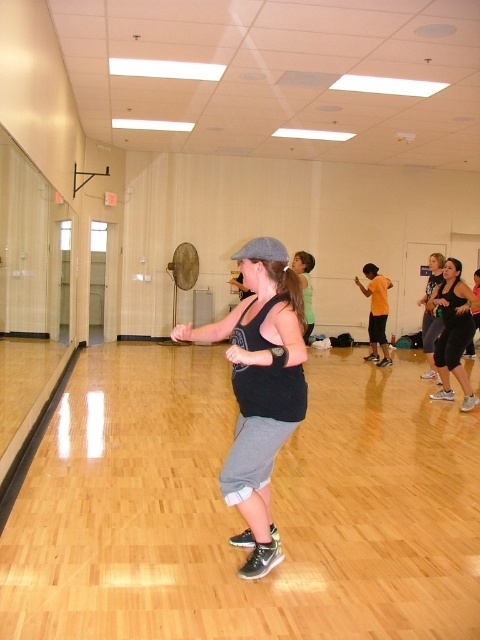
You are a fitness instructor preparing to distribute equipment. You need to place a small resistance band on the black matte tank top at center and a larger yoga mat on the black matte leggings at lower right. Based on their sizes, will the resistance band and yoga mat fit appropriately on each object?

The black matte tank top at center occupies less space than the black matte leggings at lower right. Therefore, the small resistance band will fit on the black matte tank top at center, and the larger yoga mat will also fit on the black matte leggings at lower right since it has more space available.

In the fitness class scene, there is a black matte tank top at center and a black matte leggings at lower right. Which piece of clothing is positioned to the left of the other?

The black matte tank top at center is to the left of the black matte leggings at lower right.